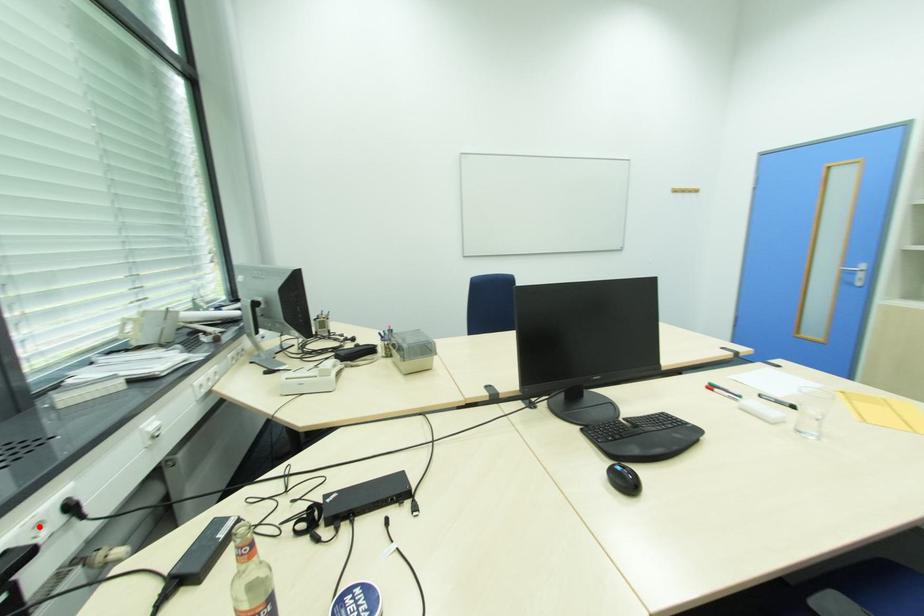
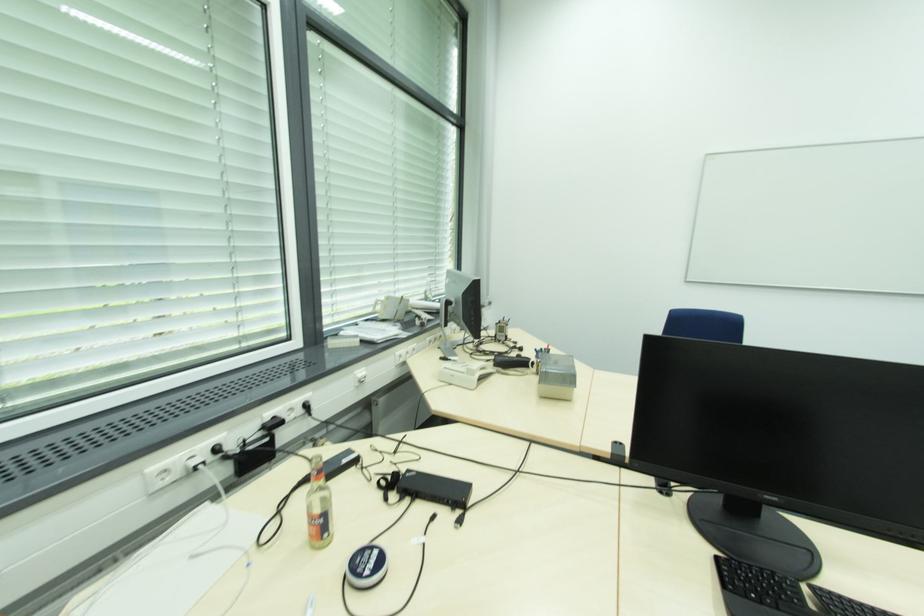
Locate, in the second image, the point that corresponds to the highlighted location in the first image.

(294, 410)